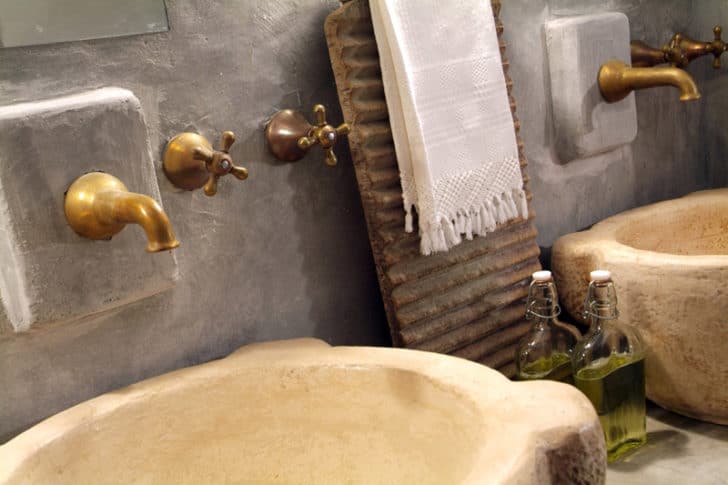
Locate an element on the screen. The width and height of the screenshot is (728, 485). mirror is located at coordinates (71, 23).